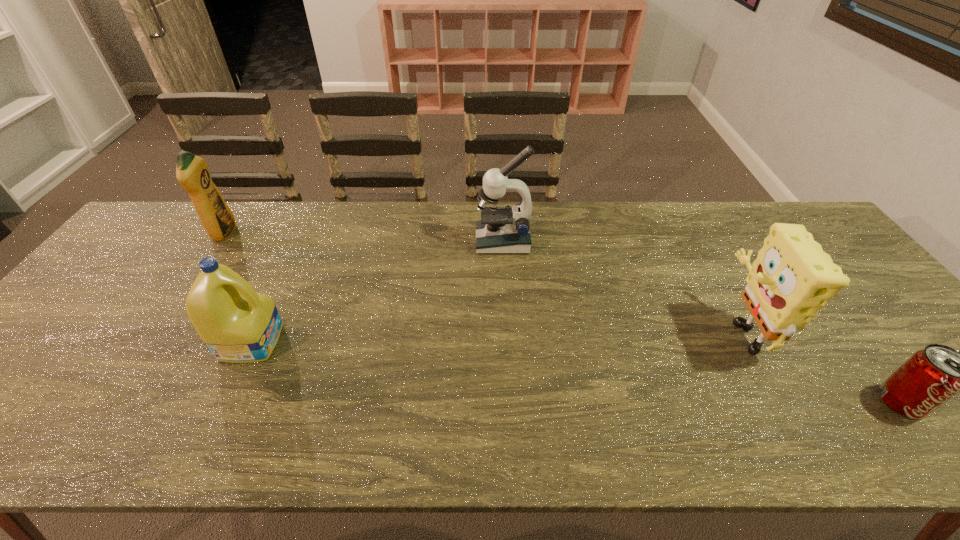
I want to click on the third object from right to left, so click(x=501, y=229).

Image resolution: width=960 pixels, height=540 pixels. Identify the location of sponge. (792, 278).

This screenshot has width=960, height=540. Identify the location of the leftmost object. (192, 172).

Find the location of a particular element. Image resolution: width=960 pixels, height=540 pixels. the farther detergent is located at coordinates (192, 172).

The width and height of the screenshot is (960, 540). I want to click on the second object from left to right, so click(238, 325).

This screenshot has width=960, height=540. Find the location of `the nearer detergent`. the nearer detergent is located at coordinates (238, 325).

The width and height of the screenshot is (960, 540). What are the coordinates of `the shortest object` in the screenshot? It's located at (930, 377).

I want to click on pop soda, so 930,377.

Locate an element on the screen. This screenshot has height=540, width=960. vacant space located on the left of the microscope is located at coordinates (446, 241).

You are a GUI agent. You are given a task and a screenshot of the screen. Output one action in this format:
    pyautogui.click(x=<x>, y=<y>)
    Task: Click on the vacant space located 0.180m on the face of the sponge
    This screenshot has height=540, width=960.
    Given the screenshot: What is the action you would take?
    pyautogui.click(x=644, y=330)